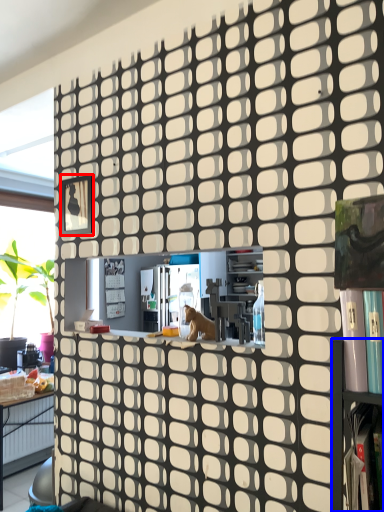
Question: Among these objects, which one is farthest to the camera, square (highlighted by a red box) or shelf (highlighted by a blue box)?

Choices:
 (A) square
 (B) shelf

Answer: (A)